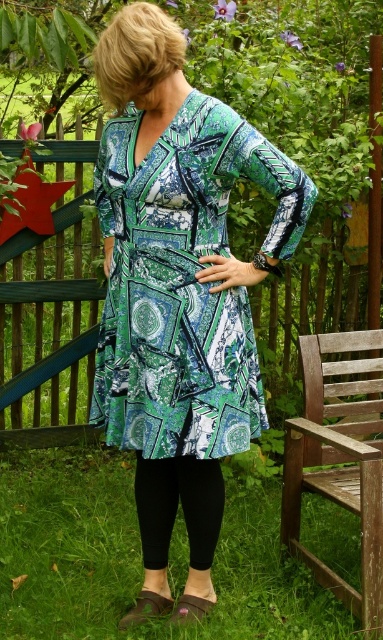
Question: Considering the real-world distances, which object is closest to the black matte leggings at lower center?

Choices:
 (A) green printed dress at center
 (B) wooden park bench at lower right
 (C) green grass at lower center

Answer: (A)

Question: Which is nearer to the green grass at lower center?

Choices:
 (A) green printed dress at center
 (B) wooden park bench at lower right
 (C) black matte leggings at lower center

Answer: (C)

Question: Does green grass at lower center appear under black matte leggings at lower center?

Choices:
 (A) yes
 (B) no

Answer: (A)

Question: In this image, where is green grass at lower center located relative to wooden park bench at lower right?

Choices:
 (A) right
 (B) left

Answer: (B)

Question: Observing the image, what is the correct spatial positioning of green printed dress at center in reference to wooden park bench at lower right?

Choices:
 (A) left
 (B) right

Answer: (A)

Question: Which object is positioned farthest from the green printed dress at center?

Choices:
 (A) wooden park bench at lower right
 (B) black matte leggings at lower center

Answer: (A)